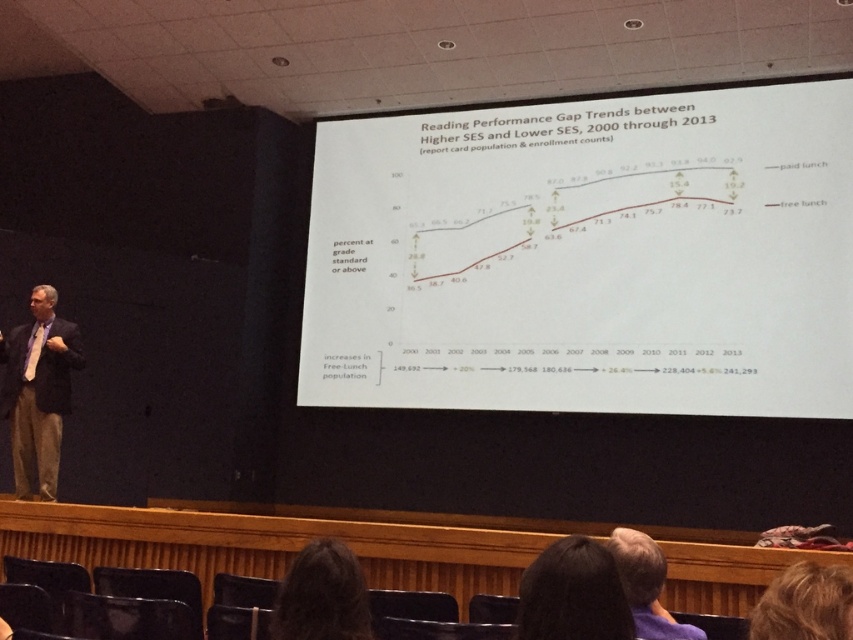
Question: Based on their relative distances, which object is farther from the gray hair at upper center?

Choices:
 (A) blonde hair at upper right
 (B) dark brown hair at lower center
 (C) dark hair at lower center
 (D) white paper at center

Answer: (D)

Question: Based on their relative distances, which object is farther from the gray hair at upper center?

Choices:
 (A) blonde hair at upper right
 (B) dark hair at lower center
 (C) white paper at center
 (D) dark brown hair at lower center

Answer: (C)

Question: Does white paper at center appear under matte black suit at left?

Choices:
 (A) yes
 (B) no

Answer: (B)

Question: Which object appears closest to the camera in this image?

Choices:
 (A) matte black suit at left
 (B) dark hair at lower center
 (C) gray hair at upper center
 (D) white paper at center

Answer: (B)

Question: Can you confirm if white paper at center is smaller than dark brown hair at lower center?

Choices:
 (A) yes
 (B) no

Answer: (B)

Question: Is white paper at center below matte black suit at left?

Choices:
 (A) yes
 (B) no

Answer: (B)